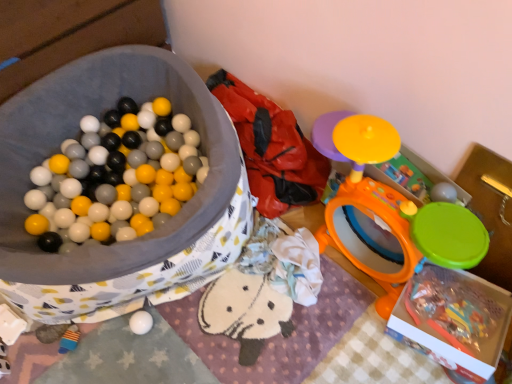
Identify the location of spots to the right of smooth plastic toy at lower left, placed as the 1th toy when sorted from left to right. (119, 354).